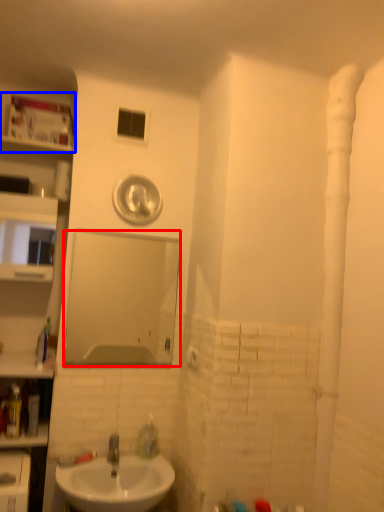
Question: Which object is closer to the camera taking this photo, mirror (highlighted by a red box) or shelf (highlighted by a blue box)?

Choices:
 (A) mirror
 (B) shelf

Answer: (A)